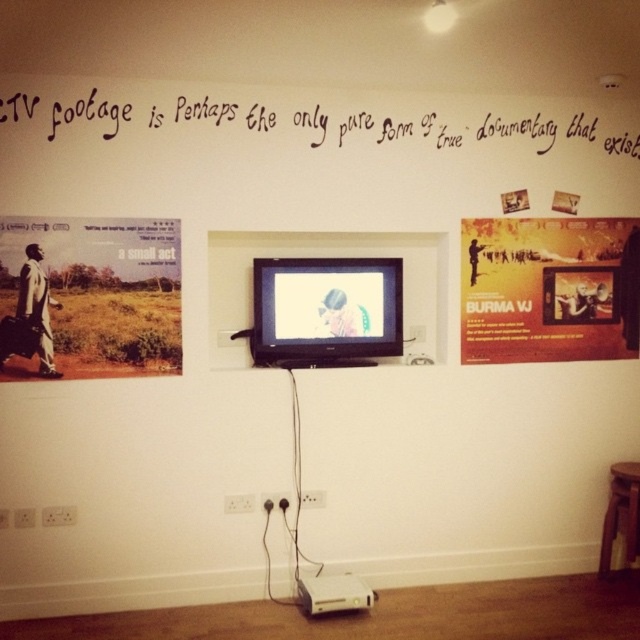
Is yellow paper poster at upper right above black calligraphy at upper center?

Actually, yellow paper poster at upper right is below black calligraphy at upper center.

Which of these two, yellow paper poster at upper right or black calligraphy at upper center, stands shorter?

black calligraphy at upper center is shorter.

Between point (486, 342) and point (576, 134), which one is positioned behind?

The point (576, 134) is more distant.

Locate an element on the screen. yellow paper poster at upper right is located at coordinates (548, 289).

Which of these two, black calligraphy at upper center or matte black flat screen tv at center, stands taller?

Standing taller between the two is matte black flat screen tv at center.

Does point (250, 131) come farther from viewer compared to point (392, 348)?

No.

Where is `black calligraphy at upper center`? black calligraphy at upper center is located at coordinates (320, 120).

Is black calligraphy at upper center closer to the viewer compared to brown wooden stool at lower right?

Yes, it is in front of brown wooden stool at lower right.

Looking at this image, is black calligraphy at upper center above brown wooden stool at lower right?

Yes, black calligraphy at upper center is above brown wooden stool at lower right.

Is point (548, 132) positioned before point (608, 502)?

Yes, point (548, 132) is in front of point (608, 502).

Where is `black calligraphy at upper center`? The height and width of the screenshot is (640, 640). black calligraphy at upper center is located at coordinates (320, 120).